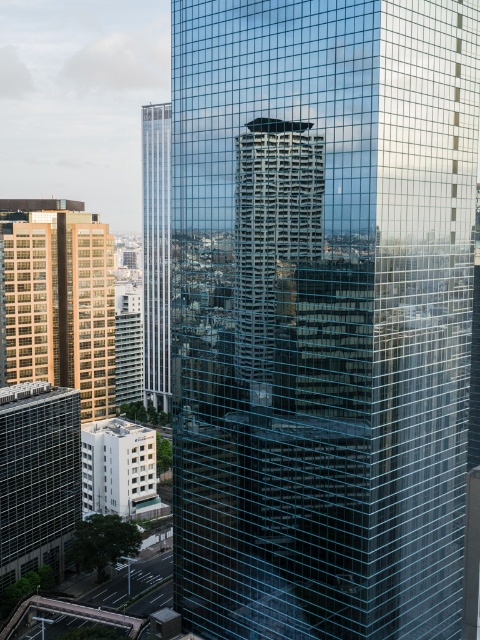
You are standing in the middle of the city and see the transparent glass skyscraper at center and the clear glass skyscraper at center. Which one is more to the right?

The transparent glass skyscraper at center is more to the right side of the clear glass skyscraper at center.

You are standing in the city square and want to take a photo of both the golden glass building at left and the clear glass skyscraper at center. Which building should you position yourself closer to in order to capture both in the same frame?

You should position yourself closer to the golden glass building at left because it is nearer to you than the clear glass skyscraper at center, allowing both to be included in the frame without one being too far away.

You are an architect analyzing the urban layout. You observe the transparent glass skyscraper at center and the clear glass skyscraper at center in the image. Which of these two skyscrapers appears to take up more visual space in the scene?

The clear glass skyscraper at center occupies more visual space than the transparent glass skyscraper at center, as stated in the description.